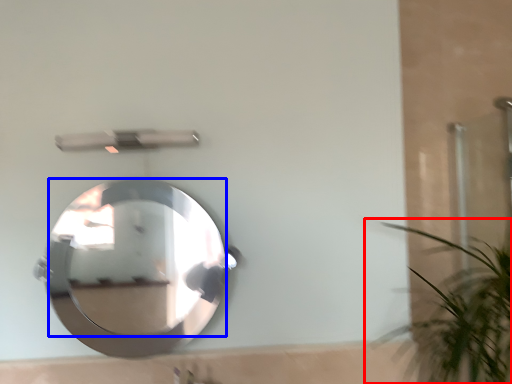
Question: Which point is further to the camera, houseplant (highlighted by a red box) or mirror (highlighted by a blue box)?

Choices:
 (A) houseplant
 (B) mirror

Answer: (B)